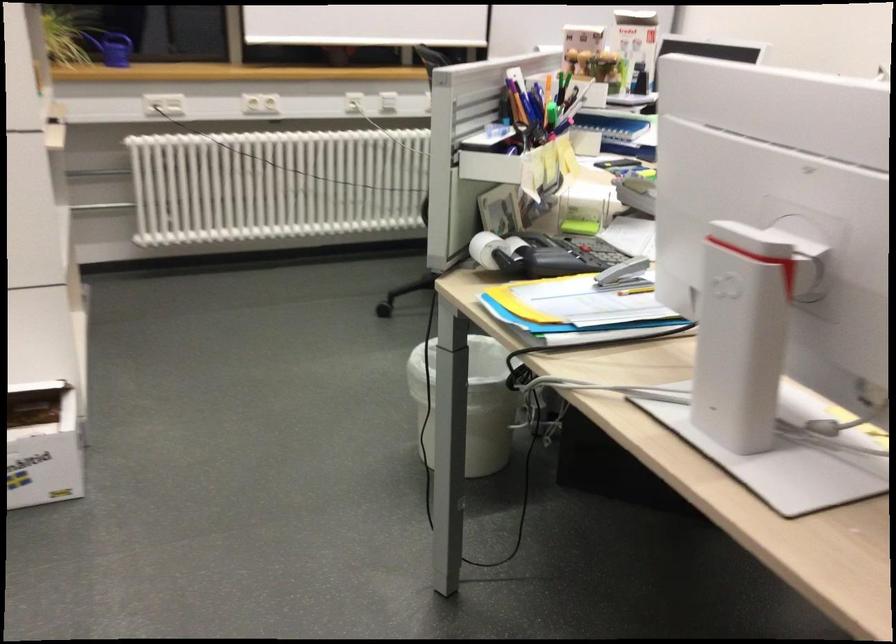
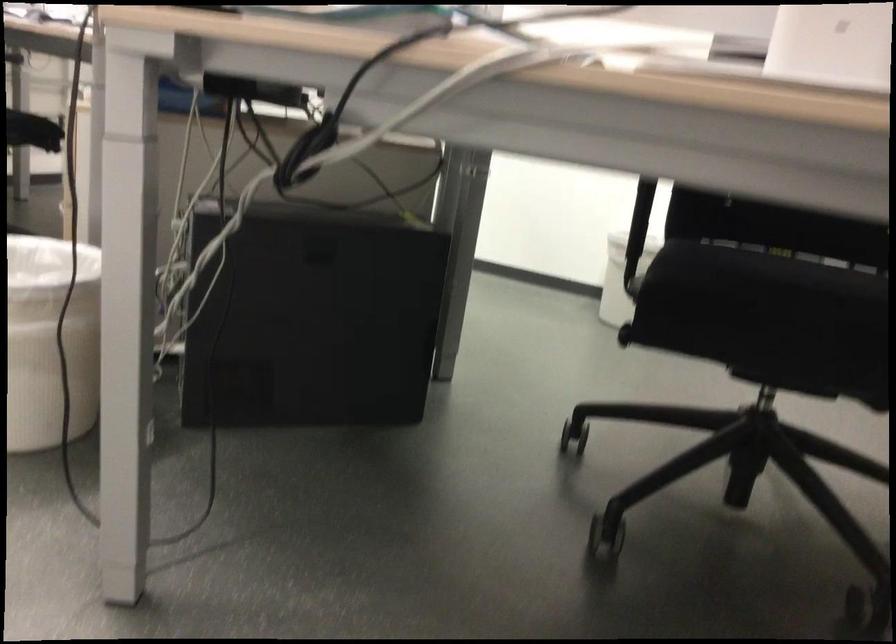
Question: The camera is either moving clockwise (left) or counter-clockwise (right) around the object. The first image is from the beginning of the video and the second image is from the end. Is the camera moving left or right when shooting the video?

Choices:
 (A) Left
 (B) Right

Answer: (A)